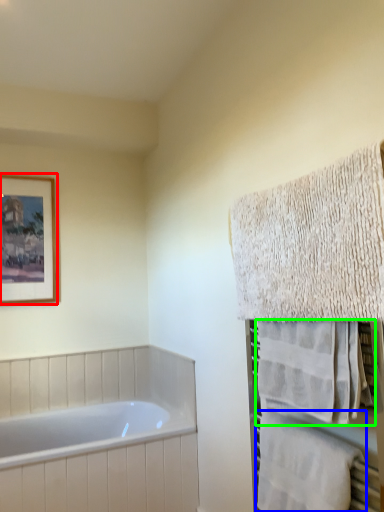
Question: Which is farther away from picture frame (highlighted by a red box)? towel (highlighted by a blue box) or towel (highlighted by a green box)?

Choices:
 (A) towel
 (B) towel

Answer: (A)